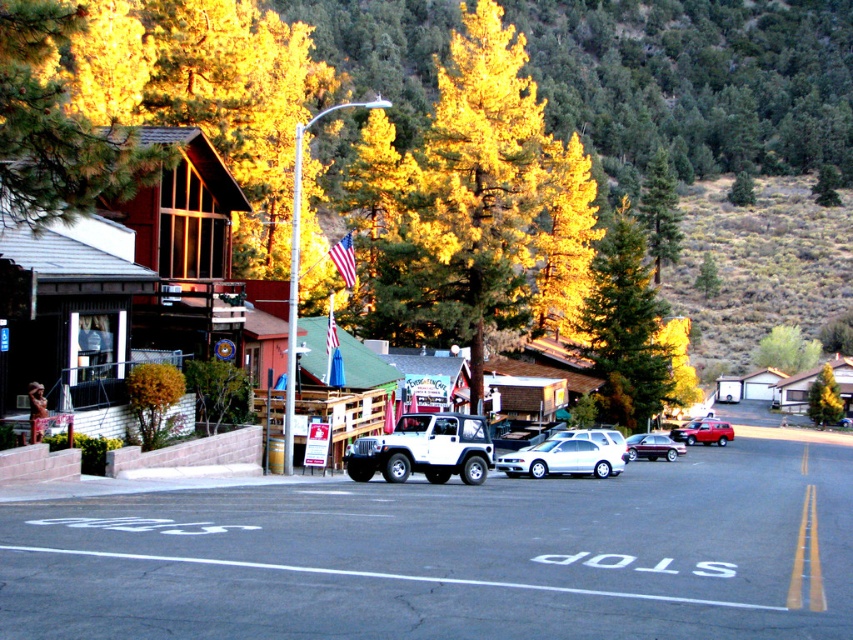
You are driving a delivery truck and need to park your vehicle on the road with the STOP marking. There is a green leafy tree at center and a white glossy sedan at center. Can you safely park your truck between these two objects without blocking the road?

The green leafy tree at center is positioned over the white glossy sedan at center, meaning they are in the same location. Therefore, there is no space between them to park your truck safely without blocking the road.

Looking at this image, you are standing at the edge of the road in the small town scene. You see two points marked in the image. Which point is closer to you, point (837,413) or point (659,435)?

Point (837,413) is further to the viewer than point (659,435), so the closer point to you is point (659,435).